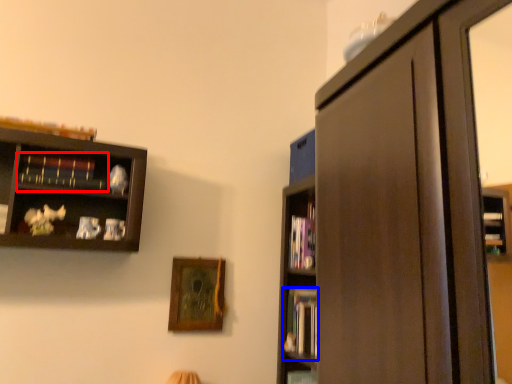
Question: Among these objects, which one is farthest to the camera, book (highlighted by a red box) or book (highlighted by a blue box)?

Choices:
 (A) book
 (B) book

Answer: (B)